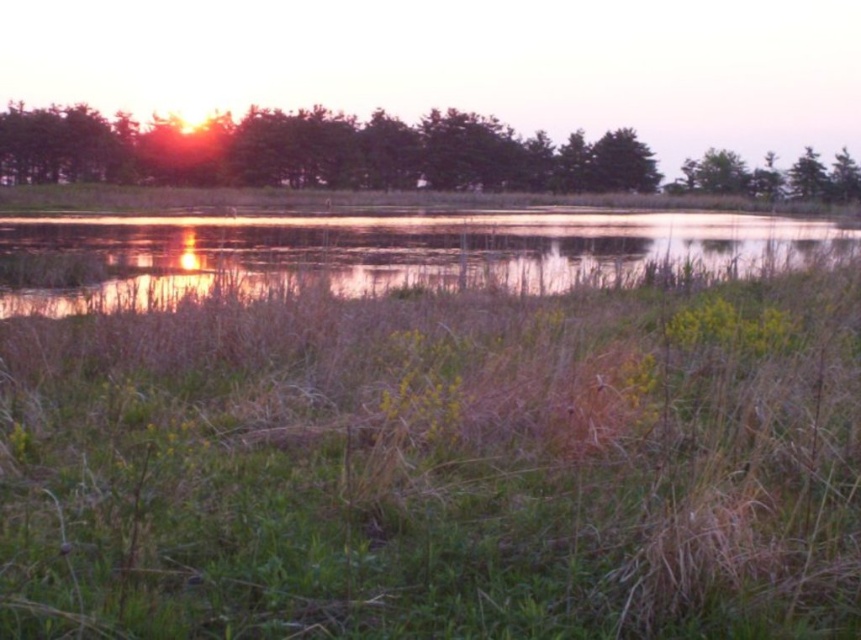
Who is more forward, (667,580) or (122,168)?

Point (667,580) is more forward.

Does green grassy at center have a greater height compared to green leafy trees at upper center?

In fact, green grassy at center may be shorter than green leafy trees at upper center.

Which is behind, point (767, 289) or point (46, 129)?

The point (46, 129) is behind.

Identify the location of green grassy at center. This screenshot has width=861, height=640. (440, 465).

Who is positioned more to the left, green grassy at center or reflective water at center?

From the viewer's perspective, reflective water at center appears more on the left side.

Is point (131, 426) closer to camera compared to point (209, 230)?

Yes, it is in front of point (209, 230).

Where is `green grassy at center`? Image resolution: width=861 pixels, height=640 pixels. green grassy at center is located at coordinates (440, 465).

Does point (112, 248) come farther from viewer compared to point (8, 176)?

That is False.

Is reflective water at center in front of green leafy trees at upper center?

Yes.

Does point (109, 236) come in front of point (85, 120)?

Yes, point (109, 236) is closer to viewer.

Where is `reflective water at center`? reflective water at center is located at coordinates (395, 252).